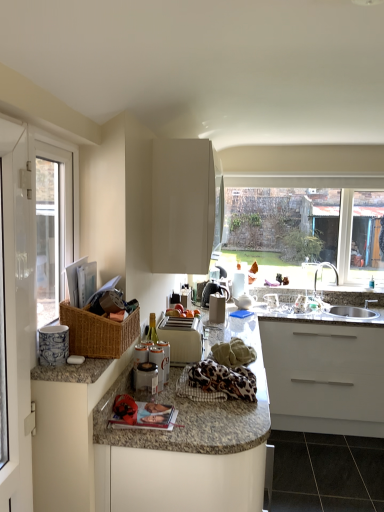
This screenshot has width=384, height=512. In order to click on blank space situated above satin silver sink at lower right (from a real-world perspective) in this screenshot , I will do `click(356, 307)`.